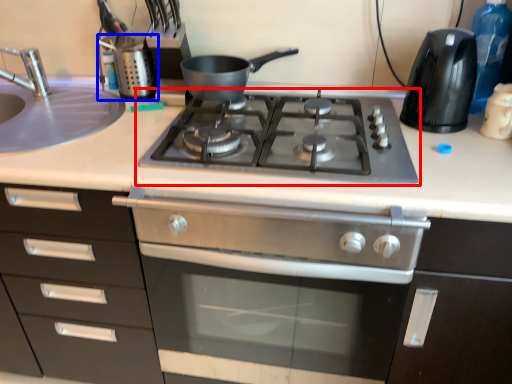
Question: Which object appears farthest to the camera in this image, gas stove (highlighted by a red box) or appliance (highlighted by a blue box)?

Choices:
 (A) gas stove
 (B) appliance

Answer: (B)